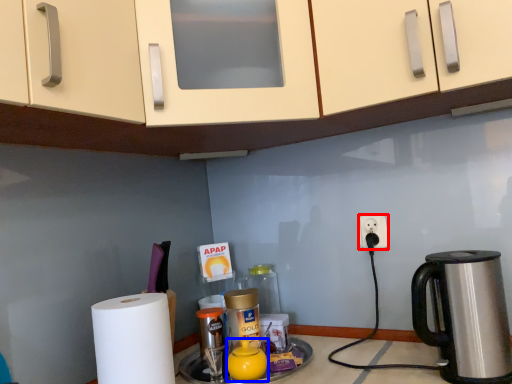
Question: Which point is closer to the camera, power outlet (highlighted by a red box) or tea pot (highlighted by a blue box)?

Choices:
 (A) power outlet
 (B) tea pot

Answer: (B)